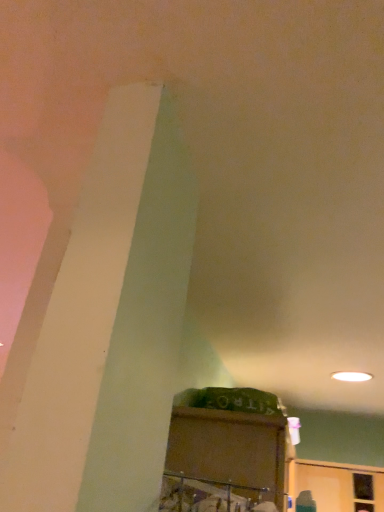
What is the approximate width of matte brown cabinet at center?

15.20 inches.

You are a GUI agent. You are given a task and a screenshot of the screen. Output one action in this format:
    pyautogui.click(x=<x>, y=<y>)
    Task: Click on the matte brown cabinet at center
    Image resolution: width=384 pixels, height=512 pixels.
    Given the screenshot: What is the action you would take?
    pyautogui.click(x=223, y=461)

The height and width of the screenshot is (512, 384). Describe the element at coordinates (223, 461) in the screenshot. I see `matte brown cabinet at center` at that location.

Locate an element on the screen. The height and width of the screenshot is (512, 384). matte brown cabinet at center is located at coordinates (223, 461).